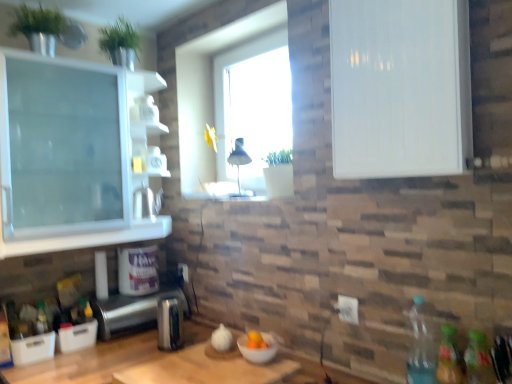
Measure the distance between point (431, 370) and camera.

Point (431, 370) is 1.35 meters away from camera.

What do you see at coordinates (422, 344) in the screenshot?
I see `clear plastic bottle at lower right, the 2th bottle when ordered from left to right` at bounding box center [422, 344].

Find the location of a particular element. The image size is (512, 384). translucent glass jar at upper center is located at coordinates (150, 162).

Identify the location of wooden cutting board at center. The image size is (512, 384). (206, 368).

Find the location of `translucent plastic bottle at lower right, acting as the fourth bottle starting from the left`. translucent plastic bottle at lower right, acting as the fourth bottle starting from the left is located at coordinates (478, 360).

Looking at this image, what is the approximate width of transparent glass window at center?

transparent glass window at center is 10.77 centimeters in width.

What do you see at coordinates (253, 105) in the screenshot? Image resolution: width=512 pixels, height=384 pixels. I see `transparent glass window at center` at bounding box center [253, 105].

Locate an element on the screen. The width and height of the screenshot is (512, 384). satin silver toaster at lower center, which is the 1th appliance in front-to-back order is located at coordinates (x=170, y=324).

Based on the photo, in the image, is translucent plastic bottle at lower left, which ranks as the first bottle in back-to-front order, on the left side or the right side of white glossy cabinet at upper right?

In the image, translucent plastic bottle at lower left, which ranks as the first bottle in back-to-front order, appears on the left side of white glossy cabinet at upper right.

From the image's perspective, which one is positioned higher, translucent plastic bottle at lower left, the fourth bottle viewed from the right, or white glossy cabinet at upper right?

From the image's view, white glossy cabinet at upper right is above.

In terms of height, does translucent plastic bottle at lower left, marked as the 4th bottle in a front-to-back arrangement, look taller or shorter compared to white glossy cabinet at upper right?

In the image, translucent plastic bottle at lower left, marked as the 4th bottle in a front-to-back arrangement, appears to be shorter than white glossy cabinet at upper right.

Considering the sizes of translucent plastic bottle at lower left, marked as the 4th bottle in a front-to-back arrangement, and white glossy cabinet at upper right in the image, is translucent plastic bottle at lower left, marked as the 4th bottle in a front-to-back arrangement, bigger or smaller than white glossy cabinet at upper right?

translucent plastic bottle at lower left, marked as the 4th bottle in a front-to-back arrangement, is smaller than white glossy cabinet at upper right.

Where is `bottle that is the 2nd one when counting rightward from the wooden cutting board at center`? Image resolution: width=512 pixels, height=384 pixels. bottle that is the 2nd one when counting rightward from the wooden cutting board at center is located at coordinates coord(449,358).

From the image's perspective, between wooden cutting board at center and translucent plastic bottle at lower right, which is the 2th bottle from front to back, who is located below?

wooden cutting board at center appears lower in the image.

In the image, is wooden cutting board at center positioned in front of or behind translucent plastic bottle at lower right, which is the 2th bottle from front to back?

wooden cutting board at center is behind translucent plastic bottle at lower right, which is the 2th bottle from front to back.

Which of these two, wooden cutting board at center or translucent plastic bottle at lower right, which is counted as the third bottle, starting from the back, is thinner?

With smaller width is translucent plastic bottle at lower right, which is counted as the third bottle, starting from the back.

Consider the image. Is the surface of translucent plastic bottle at lower right, which is the 4th bottle from back to front, in direct contact with white glossy cabinet at upper right?

No, translucent plastic bottle at lower right, which is the 4th bottle from back to front, is not with white glossy cabinet at upper right.

Which bottle is the 3rd one when counting from the right side of the white glossy cabinet at upper right? Please provide its 2D coordinates.

[(478, 360)]

Does point (484, 363) come farther from viewer compared to point (333, 40)?

No, it is in front of (333, 40).

From a real-world perspective, is translucent plastic bottle at lower right, which is the 4th bottle from back to front, positioned over white glossy cabinet at upper right based on gravity?

No, from a real-world perspective, translucent plastic bottle at lower right, which is the 4th bottle from back to front, is not over white glossy cabinet at upper right

Looking at their sizes, would you say satin silver toaster at lower left, arranged as the 2th appliance when viewed from the front, is wider or thinner than translucent plastic bottle at lower left, marked as the 4th bottle in a front-to-back arrangement?

Considering their sizes, satin silver toaster at lower left, arranged as the 2th appliance when viewed from the front, looks broader than translucent plastic bottle at lower left, marked as the 4th bottle in a front-to-back arrangement.

From the image's perspective, which one is positioned higher, satin silver toaster at lower left, which is the 2th appliance from back to front, or translucent plastic bottle at lower left, which ranks as the first bottle in back-to-front order?

translucent plastic bottle at lower left, which ranks as the first bottle in back-to-front order.

Does satin silver toaster at lower left, which is the 2th appliance from back to front, contain translucent plastic bottle at lower left, the 1th bottle when ordered from left to right?

No.

Is satin silver toaster at lower left, which is the 2th appliance from back to front, positioned before translucent plastic bottle at lower left, marked as the 4th bottle in a front-to-back arrangement?

That is False.

What's the angular difference between white glossy cabinet at upper right and satin silver toaster at lower center, which is the 3th appliance in back-to-front order,'s facing directions?

There is a 3.36-degree angle between the facing directions of white glossy cabinet at upper right and satin silver toaster at lower center, which is the 3th appliance in back-to-front order.

From a real-world perspective, is white glossy cabinet at upper right located beneath satin silver toaster at lower center, which is the 1th appliance in front-to-back order?

No, from a real-world perspective, white glossy cabinet at upper right is not beneath satin silver toaster at lower center, which is the 1th appliance in front-to-back order.

Is white glossy cabinet at upper right in front of or behind satin silver toaster at lower center, which is the 1th appliance in front-to-back order, in the image?

white glossy cabinet at upper right is in front of satin silver toaster at lower center, which is the 1th appliance in front-to-back order.

From the image's perspective, would you say translucent plastic bottle at lower right, which is the 2th bottle from front to back, is positioned over satin silver toaster at lower center, which is the 3th appliance in back-to-front order?

Yes, from the image's perspective, translucent plastic bottle at lower right, which is the 2th bottle from front to back, is on top of satin silver toaster at lower center, which is the 3th appliance in back-to-front order.

Is translucent plastic bottle at lower right, which is counted as the third bottle, starting from the back, turned away from satin silver toaster at lower center, which is the 3th appliance in back-to-front order?

No.

From the translucent plastic bottle at lower right, the second bottle in the right-to-left sequence, count 1st appliances backward and point to it. Please provide its 2D coordinates.

[(170, 324)]

Which object is further away from the camera taking this photo, translucent plastic bottle at lower right, which is the 2th bottle from front to back, or satin silver toaster at lower center, which is the 1th appliance in front-to-back order?

satin silver toaster at lower center, which is the 1th appliance in front-to-back order.

Considering the positions of objects satin silver toaster at lower center, which is the 1th appliance in front-to-back order, and white glossy cabinet at upper right in the image provided, who is in front, satin silver toaster at lower center, which is the 1th appliance in front-to-back order, or white glossy cabinet at upper right?

white glossy cabinet at upper right is closer to the camera.

Is satin silver toaster at lower center, which is the 1th appliance in front-to-back order, taller than white glossy cabinet at upper right?

No, satin silver toaster at lower center, which is the 1th appliance in front-to-back order, is not taller than white glossy cabinet at upper right.

Consider the image. From the image's perspective, which one is positioned lower, satin silver toaster at lower center, which is the 1th appliance in front-to-back order, or white glossy cabinet at upper right?

satin silver toaster at lower center, which is the 1th appliance in front-to-back order, is shown below in the image.

Locate an element on the screen. The image size is (512, 384). cabinetry above the translucent plastic bottle at lower left, the 1th bottle when ordered from left to right (from the image's perspective) is located at coordinates (400, 88).

Identify the location of the 1st bottle in front of the wooden cutting board at center. This screenshot has width=512, height=384. (449, 358).

When comparing their distances from translucent plastic bottle at lower right, which is the 3th bottle in left-to-right order, does satin silver toaster at lower left, which is the 2th appliance from back to front, or translucent glass jar at upper center seem closer?

The object closer to translucent plastic bottle at lower right, which is the 3th bottle in left-to-right order, is satin silver toaster at lower left, which is the 2th appliance from back to front.

Looking at the image, which one is located further to white glossy cabinet at upper right, satin silver toaster at lower center, which is the 3th appliance in back-to-front order, or translucent glass jar at upper center?

Based on the image, translucent glass jar at upper center appears to be further to white glossy cabinet at upper right.

Looking at the image, which one is located closer to white glossy cabinet at upper right, satin silver toaster at lower left, which is the 2th appliance from back to front, or white plastic container at lower left, acting as the third appliance starting from the front?

Among the two, white plastic container at lower left, acting as the third appliance starting from the front, is located nearer to white glossy cabinet at upper right.

Estimate the real-world distances between objects in this image. Which object is closer to transparent glass window at center, white glossy cabinet at upper right or wooden cutting board at center?

The object closer to transparent glass window at center is white glossy cabinet at upper right.

Looking at the image, which one is located further to white glossy cabinet at upper right, translucent plastic bottle at lower left, the 1th bottle when ordered from left to right, or translucent plastic bottle at lower right, which is the 3th bottle in left-to-right order?

translucent plastic bottle at lower left, the 1th bottle when ordered from left to right, is further to white glossy cabinet at upper right.

Which object lies further to the anchor point clear plastic bottle at lower right, which appears as the third bottle when viewed from the right, translucent plastic bottle at lower right, which is the 4th bottle from back to front, or translucent plastic bottle at lower left, the 1th bottle when ordered from left to right?

translucent plastic bottle at lower left, the 1th bottle when ordered from left to right, is positioned further to the anchor clear plastic bottle at lower right, which appears as the third bottle when viewed from the right.

Estimate the real-world distances between objects in this image. Which object is further from white plastic container at lower left, acting as the third appliance starting from the front, translucent plastic bottle at lower right, which is the 3th bottle in left-to-right order, or wooden cutting board at center?

translucent plastic bottle at lower right, which is the 3th bottle in left-to-right order.

Based on the photo, when comparing their distances from satin silver toaster at lower center, which is the 1th appliance in front-to-back order, does satin silver toaster at lower left, which is the 2th appliance from back to front, or translucent plastic bottle at lower right, which is the 1th bottle in right-to-left order, seem closer?

satin silver toaster at lower left, which is the 2th appliance from back to front, is positioned closer to the anchor satin silver toaster at lower center, which is the 1th appliance in front-to-back order.

Where is `table between white plastic container at lower left, positioned as the first appliance in back-to-front order, and clear plastic bottle at lower right, the 2th bottle from the back, from left to right`? table between white plastic container at lower left, positioned as the first appliance in back-to-front order, and clear plastic bottle at lower right, the 2th bottle from the back, from left to right is located at coordinates click(x=206, y=368).

You are a GUI agent. You are given a task and a screenshot of the screen. Output one action in this format:
    pyautogui.click(x=<x>, y=<y>)
    Task: Click on the bottle between clear plastic bottle at lower right, the 2th bottle when ordered from left to right, and translucent plastic bottle at lower right, which is the 4th bottle from back to front, in the horizontal direction
    
    Given the screenshot: What is the action you would take?
    pyautogui.click(x=449, y=358)

Identify the location of table situated between white plastic container at lower left, acting as the third appliance starting from the front, and translucent plastic bottle at lower right, which is the 3th bottle in left-to-right order, from left to right. (206, 368).

At what (x,y) coordinates should I click in order to perform the action: click on shelf between satin silver toaster at lower left, arranged as the 2th appliance when viewed from the front, and clear plastic bottle at lower right, the 2th bottle when ordered from left to right, from left to right. Please return your answer as a coordinate pair (x, y). Looking at the image, I should click on (150, 162).